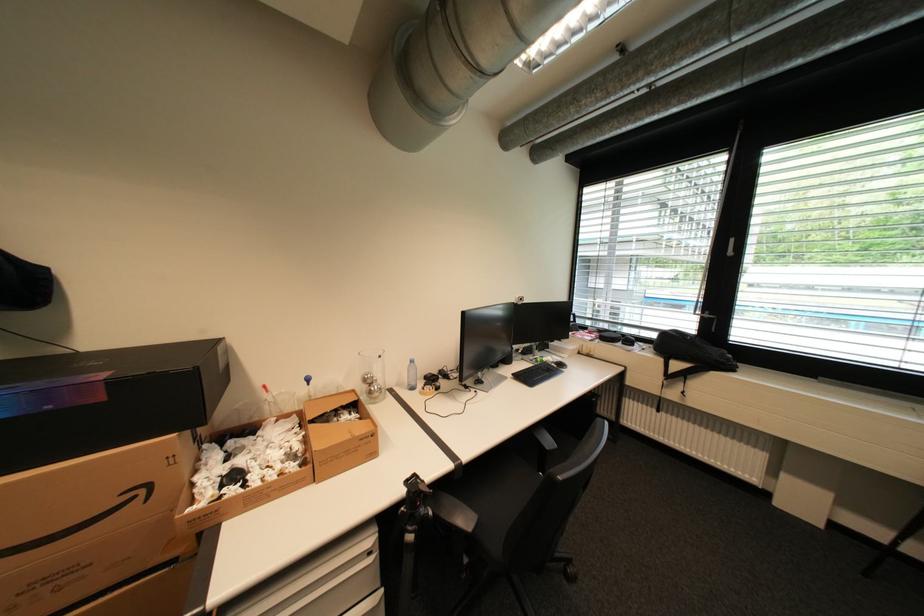
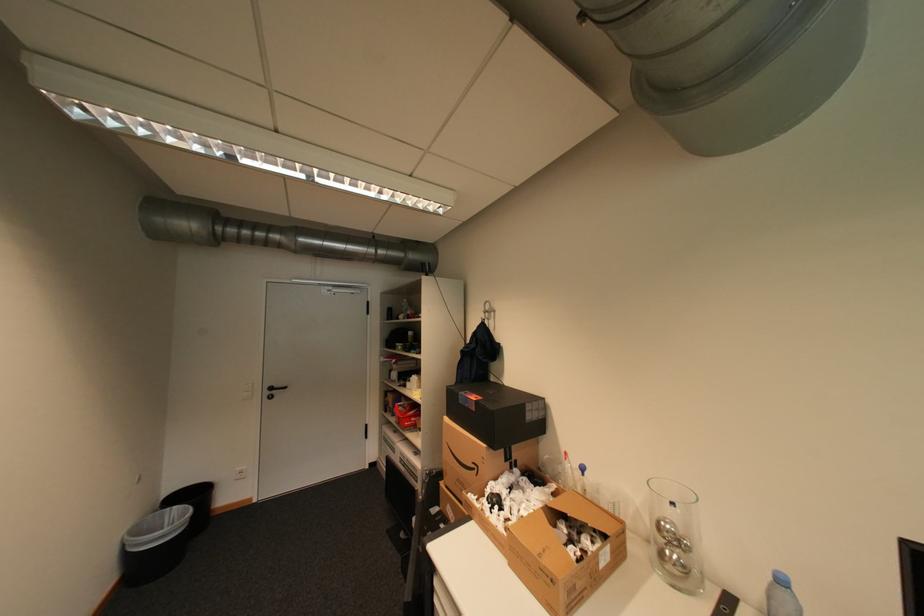
Find the pixel in the second image that matches point (377, 378) in the first image.

(673, 527)